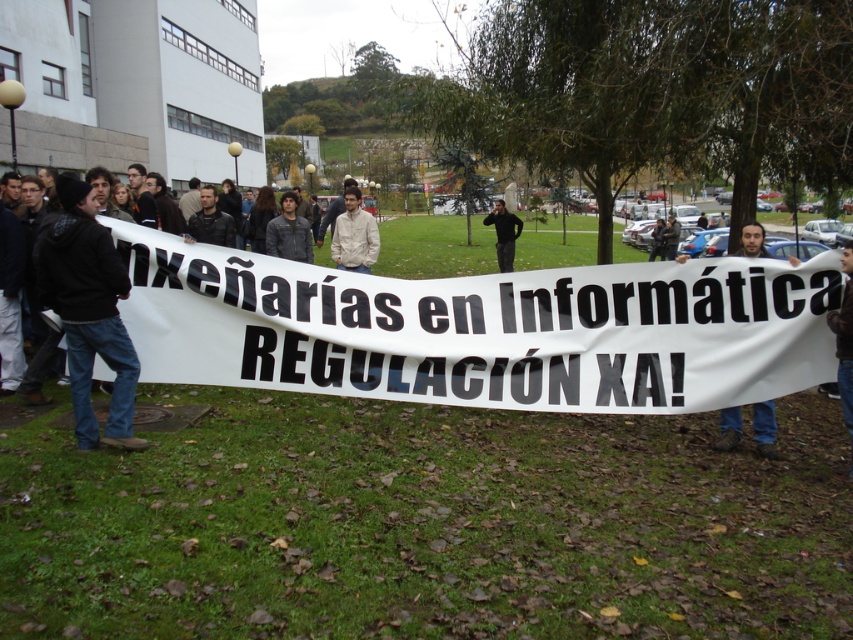
Question: In this image, where is blue jeans at center located relative to black leather jacket at center?

Choices:
 (A) above
 (B) below

Answer: (B)

Question: Which point is closer to the camera taking this photo?

Choices:
 (A) (350, 193)
 (B) (671, 228)
 (C) (86, 444)
 (D) (512, 227)

Answer: (C)

Question: Can you confirm if beige fabric shirt at center is thinner than black fabric at center?

Choices:
 (A) no
 (B) yes

Answer: (B)

Question: Based on their relative distances, which object is farther from the black fabric at center?

Choices:
 (A) blue jeans at center
 (B) black matte jacket at left
 (C) beige fabric shirt at center

Answer: (B)

Question: Which of the following is the closest to the observer?

Choices:
 (A) beige fabric shirt at center
 (B) black matte jacket at left
 (C) blue jeans at center
 (D) black fabric at center

Answer: (B)

Question: Considering the relative positions of black matte jacket at left and beige fabric shirt at center in the image provided, where is black matte jacket at left located with respect to beige fabric shirt at center?

Choices:
 (A) left
 (B) right

Answer: (A)